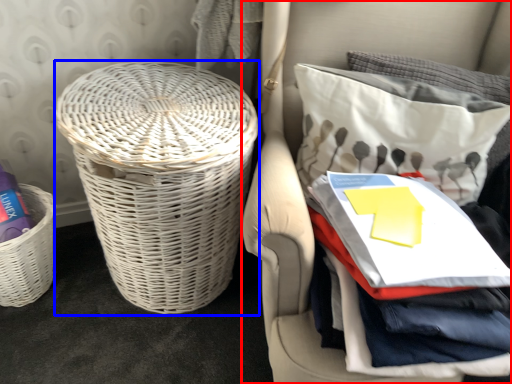
Question: Which object is closer to the camera taking this photo, furniture (highlighted by a red box) or basket (highlighted by a blue box)?

Choices:
 (A) furniture
 (B) basket

Answer: (A)